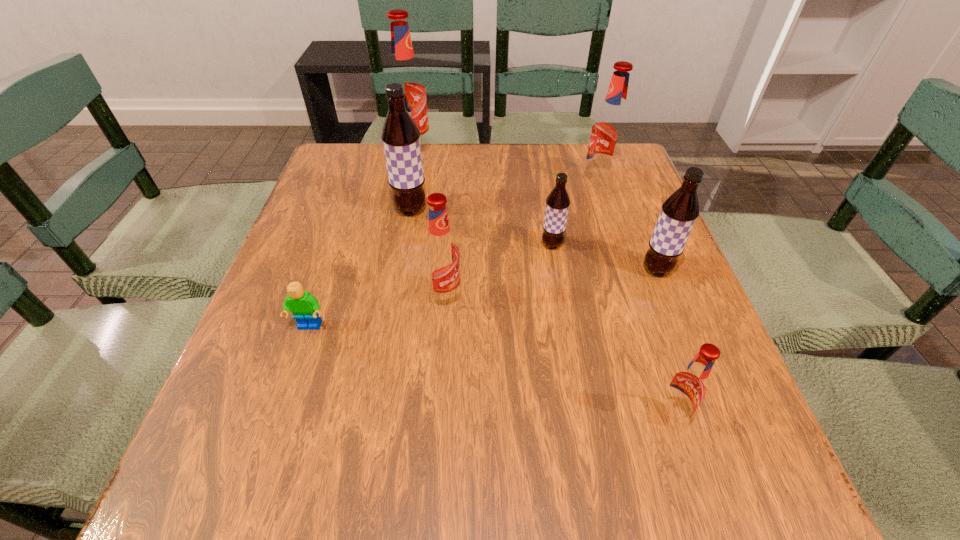
Image resolution: width=960 pixels, height=540 pixels. Find the location of `the biggest red root beer`. the biggest red root beer is located at coordinates coord(404,71).

Identify the location of the farthest object. (404, 71).

Identify the location of the third nearest red root beer. The height and width of the screenshot is (540, 960). (609, 129).

Image resolution: width=960 pixels, height=540 pixels. What are the coordinates of `the sixth nearest root beer` in the screenshot? It's located at (609, 129).

What are the coordinates of `the third farthest root beer` in the screenshot? It's located at (401, 137).

At what (x,y) coordinates should I click in order to perform the action: click on the leftmost brown root beer. Please return your answer as a coordinate pair (x, y). This screenshot has width=960, height=540. Looking at the image, I should click on (401, 137).

At what (x,y) coordinates should I click in order to perform the action: click on the rightmost brown root beer. Please return your answer as a coordinate pair (x, y). Image resolution: width=960 pixels, height=540 pixels. Looking at the image, I should click on (680, 210).

Where is `the fifth farthest root beer`? the fifth farthest root beer is located at coordinates (680, 210).

The width and height of the screenshot is (960, 540). Identify the location of the fifth object from right to left. (441, 257).

Where is `the fifth root beer from right to left`? The height and width of the screenshot is (540, 960). the fifth root beer from right to left is located at coordinates (441, 257).